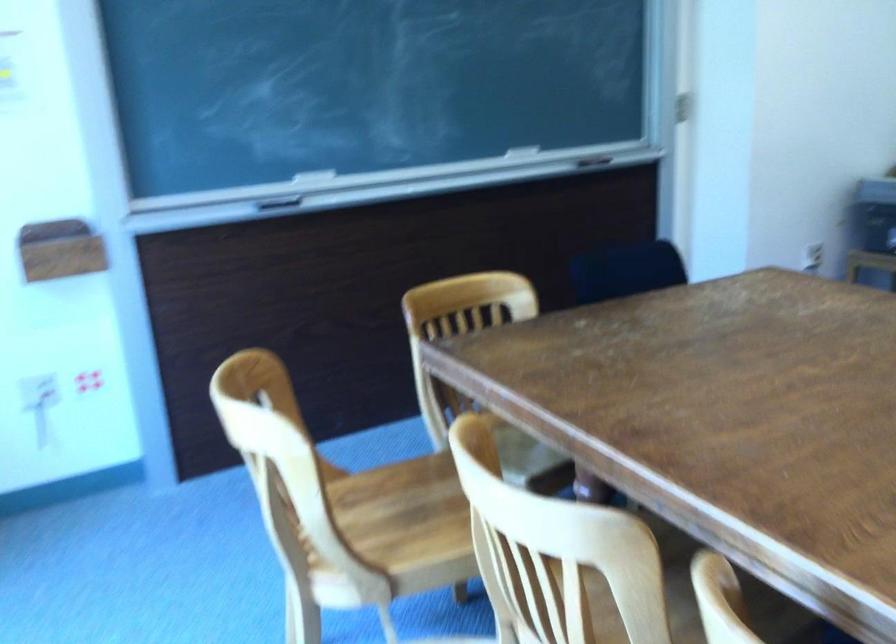
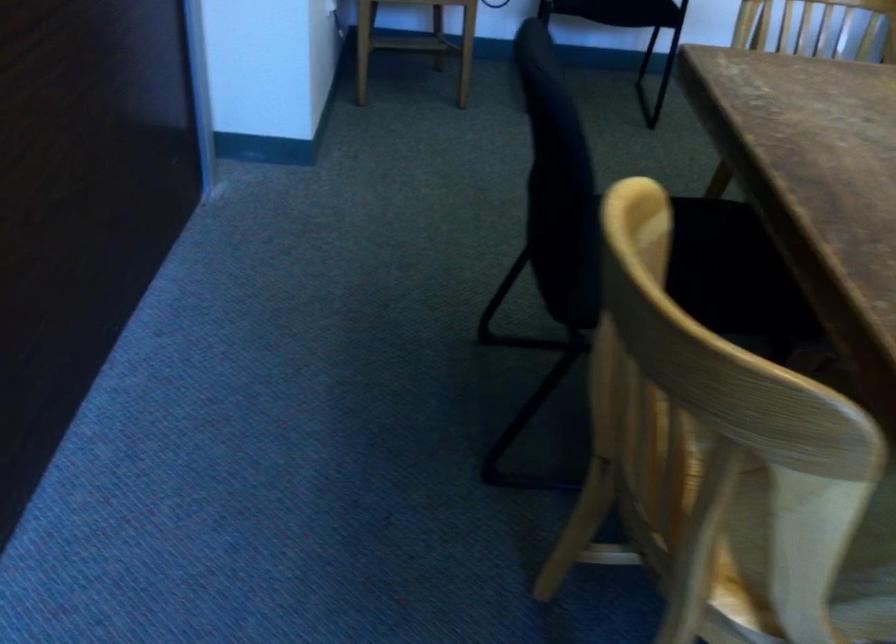
The point at [523,450] is marked in the first image. Where is the corresponding point in the second image?

(872, 538)